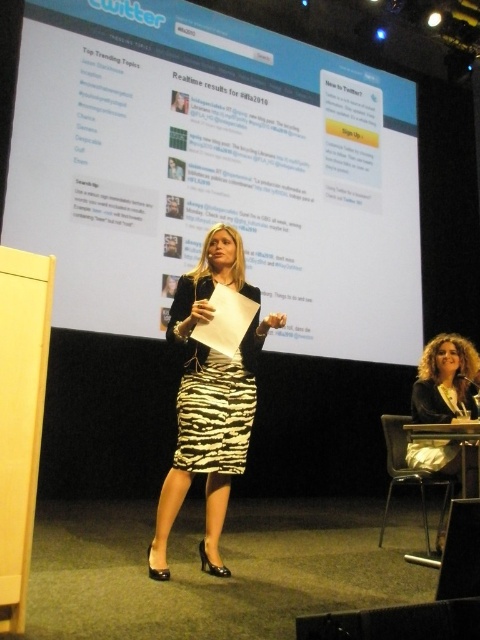
Question: Which point is farther to the camera?

Choices:
 (A) curly hair at lower right
 (B) zebra print dress at center
 (C) white glossy projection screen at upper center
 (D) zebra print skirt at center

Answer: (C)

Question: Does zebra print dress at center come in front of curly hair at lower right?

Choices:
 (A) yes
 (B) no

Answer: (A)

Question: Where is white glossy projection screen at upper center located in relation to curly hair at lower right in the image?

Choices:
 (A) above
 (B) below

Answer: (A)

Question: Estimate the real-world distances between objects in this image. Which object is farther from the white glossy projection screen at upper center?

Choices:
 (A) curly hair at lower right
 (B) zebra print dress at center

Answer: (A)

Question: Which point appears closest to the camera in this image?

Choices:
 (A) coord(252,355)
 (B) coord(422,451)

Answer: (A)

Question: Is white glossy projection screen at upper center further to camera compared to zebra print dress at center?

Choices:
 (A) no
 (B) yes

Answer: (B)